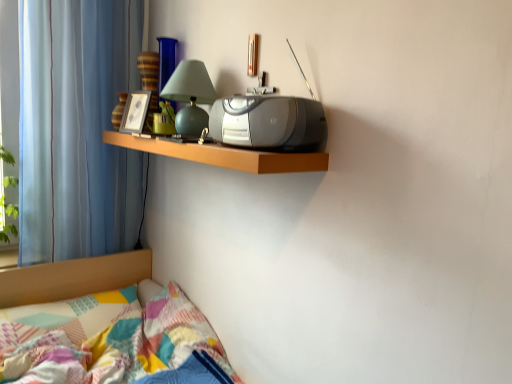
Question: Is satin silver stereo at center closer to the viewer compared to blue striped curtain at left?

Choices:
 (A) yes
 (B) no

Answer: (A)

Question: Can you confirm if satin silver stereo at center is positioned to the left of blue striped curtain at left?

Choices:
 (A) yes
 (B) no

Answer: (B)

Question: From a real-world perspective, is satin silver stereo at center positioned over blue striped curtain at left based on gravity?

Choices:
 (A) yes
 (B) no

Answer: (A)

Question: Would you say blue striped curtain at left is part of satin silver stereo at center's contents?

Choices:
 (A) yes
 (B) no

Answer: (B)

Question: From a real-world perspective, does satin silver stereo at center sit lower than blue striped curtain at left?

Choices:
 (A) no
 (B) yes

Answer: (A)

Question: From the image's perspective, is satin silver stereo at center located above blue striped curtain at left?

Choices:
 (A) no
 (B) yes

Answer: (A)

Question: From the image's perspective, is blue striped curtain at left on top of patchwork fabric bed at lower left?

Choices:
 (A) no
 (B) yes

Answer: (B)

Question: Is blue striped curtain at left not close to patchwork fabric bed at lower left?

Choices:
 (A) no
 (B) yes

Answer: (A)

Question: Is blue striped curtain at left with patchwork fabric bed at lower left?

Choices:
 (A) yes
 (B) no

Answer: (B)

Question: Is blue striped curtain at left wider than patchwork fabric bed at lower left?

Choices:
 (A) no
 (B) yes

Answer: (A)

Question: Is blue striped curtain at left taller than patchwork fabric bed at lower left?

Choices:
 (A) no
 (B) yes

Answer: (B)

Question: Does blue striped curtain at left have a lesser width compared to patchwork fabric bed at lower left?

Choices:
 (A) no
 (B) yes

Answer: (B)

Question: Is wooden shelf at upper center surrounded by patchwork fabric bed at lower left?

Choices:
 (A) no
 (B) yes

Answer: (A)